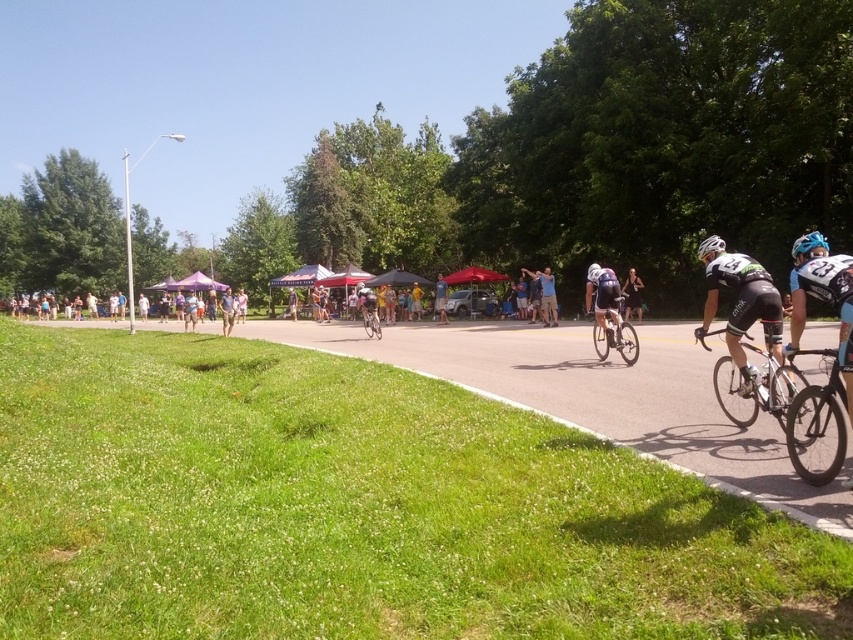
Question: Which object appears closest to the camera in this image?

Choices:
 (A) shiny blue helmet at center right
 (B) white matte bicycle helmet at center

Answer: (A)

Question: Which point is closer to the camera?

Choices:
 (A) shiny blue jersey at center
 (B) black matte cycling jersey at center

Answer: (B)

Question: Considering the real-world distances, which object is closest to the pink fabric at center?

Choices:
 (A) shiny blue jersey at center
 (B) yellow fabric at center
 (C) shiny blue helmet at center right

Answer: (B)

Question: Can you confirm if silver metallic bicycle at center is positioned above light blue fabric umbrella at center?

Choices:
 (A) yes
 (B) no

Answer: (B)

Question: Does shiny blue helmet at center right appear under yellow fabric at center?

Choices:
 (A) yes
 (B) no

Answer: (B)

Question: Is shiny black bike at center below shiny silver bicycle at center?

Choices:
 (A) no
 (B) yes

Answer: (B)